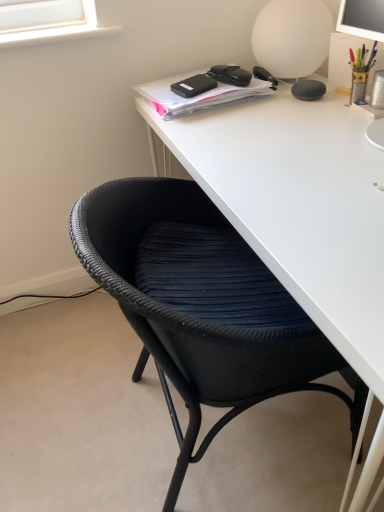
Question: Should I look upward or downward to see black matte glasses at upper center, acting as the third stationery starting from the right?

Choices:
 (A) down
 (B) up

Answer: (B)

Question: Considering the relative sizes of matte black speaker at upper right, which is the second stationery from right to left, and white matte desk at center in the image provided, is matte black speaker at upper right, which is the second stationery from right to left, taller than white matte desk at center?

Choices:
 (A) no
 (B) yes

Answer: (A)

Question: Is white matte desk at center located within matte black speaker at upper right, which is the second stationery from right to left?

Choices:
 (A) no
 (B) yes

Answer: (A)

Question: Is matte black speaker at upper right, which is the second stationery from right to left, completely or partially outside of white matte desk at center?

Choices:
 (A) yes
 (B) no

Answer: (A)

Question: From the image's perspective, is matte black speaker at upper right, which is the second stationery from right to left, on top of white matte desk at center?

Choices:
 (A) no
 (B) yes

Answer: (B)

Question: Could you tell me if matte black speaker at upper right, which is the second stationery from right to left, is facing white matte desk at center?

Choices:
 (A) yes
 (B) no

Answer: (B)

Question: Can you confirm if matte black speaker at upper right, which is the second stationery from right to left, is wider than white matte desk at center?

Choices:
 (A) no
 (B) yes

Answer: (A)

Question: Considering the relative positions of metallic gold pen holder at upper right, acting as the 4th stationery starting from the left, and black matte hard drive at upper center, the 4th stationery in the right-to-left sequence, in the image provided, is metallic gold pen holder at upper right, acting as the 4th stationery starting from the left, behind black matte hard drive at upper center, the 4th stationery in the right-to-left sequence,?

Choices:
 (A) no
 (B) yes

Answer: (A)

Question: From the image's perspective, is metallic gold pen holder at upper right, acting as the 4th stationery starting from the left, on top of black matte hard drive at upper center, the 4th stationery in the right-to-left sequence?

Choices:
 (A) no
 (B) yes

Answer: (A)

Question: Is metallic gold pen holder at upper right, which is the first stationery in right-to-left order, positioned in front of black matte hard drive at upper center, placed as the first stationery when sorted from left to right?

Choices:
 (A) no
 (B) yes

Answer: (B)

Question: Considering the relative sizes of metallic gold pen holder at upper right, which is the first stationery in right-to-left order, and black matte hard drive at upper center, placed as the first stationery when sorted from left to right, in the image provided, is metallic gold pen holder at upper right, which is the first stationery in right-to-left order, bigger than black matte hard drive at upper center, placed as the first stationery when sorted from left to right,?

Choices:
 (A) yes
 (B) no

Answer: (A)

Question: From a real-world perspective, is metallic gold pen holder at upper right, which is the first stationery in right-to-left order, physically above black matte hard drive at upper center, the 4th stationery in the right-to-left sequence?

Choices:
 (A) no
 (B) yes

Answer: (B)

Question: Is metallic gold pen holder at upper right, acting as the 4th stationery starting from the left, next to black matte hard drive at upper center, the 4th stationery in the right-to-left sequence?

Choices:
 (A) no
 (B) yes

Answer: (A)

Question: Is black matte notebook at upper center further to camera compared to white matte table lamp at upper right?

Choices:
 (A) yes
 (B) no

Answer: (B)